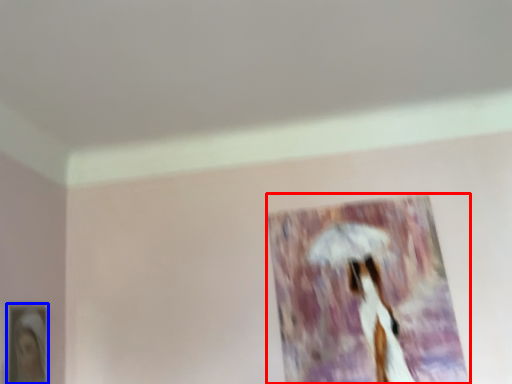
Question: Which point is closer to the camera, picture frame (highlighted by a red box) or picture frame (highlighted by a blue box)?

Choices:
 (A) picture frame
 (B) picture frame

Answer: (B)